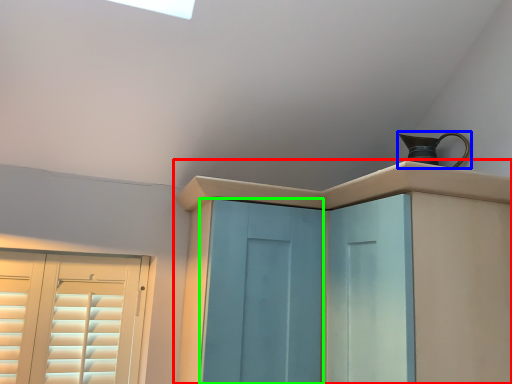
Question: Which object is positioned closest to cupboard (highlighted by a red box)? Select from jug (highlighted by a blue box) and screen door (highlighted by a green box).

Choices:
 (A) jug
 (B) screen door

Answer: (B)